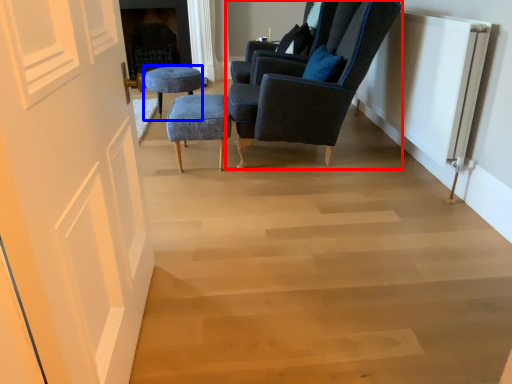
Question: Among these objects, which one is farthest to the camera, chair (highlighted by a red box) or stool (highlighted by a blue box)?

Choices:
 (A) chair
 (B) stool

Answer: (B)